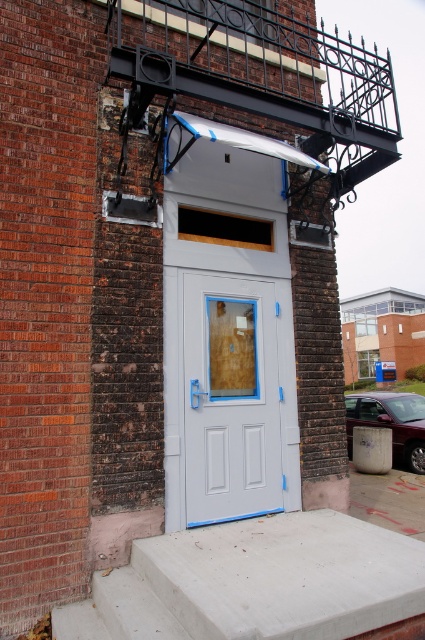
Question: Is concrete at lower center positioned at the back of white painted wood door at center?

Choices:
 (A) yes
 (B) no

Answer: (B)

Question: Which of the following is the closest to the observer?

Choices:
 (A) (198, 616)
 (B) (235, 499)

Answer: (A)

Question: Which object appears closest to the camera in this image?

Choices:
 (A) white painted wood door at center
 (B) concrete at lower center

Answer: (B)

Question: Is concrete at lower center positioned in front of white painted wood door at center?

Choices:
 (A) yes
 (B) no

Answer: (A)

Question: Observing the image, what is the correct spatial positioning of concrete at lower center in reference to white painted wood door at center?

Choices:
 (A) right
 (B) left

Answer: (A)